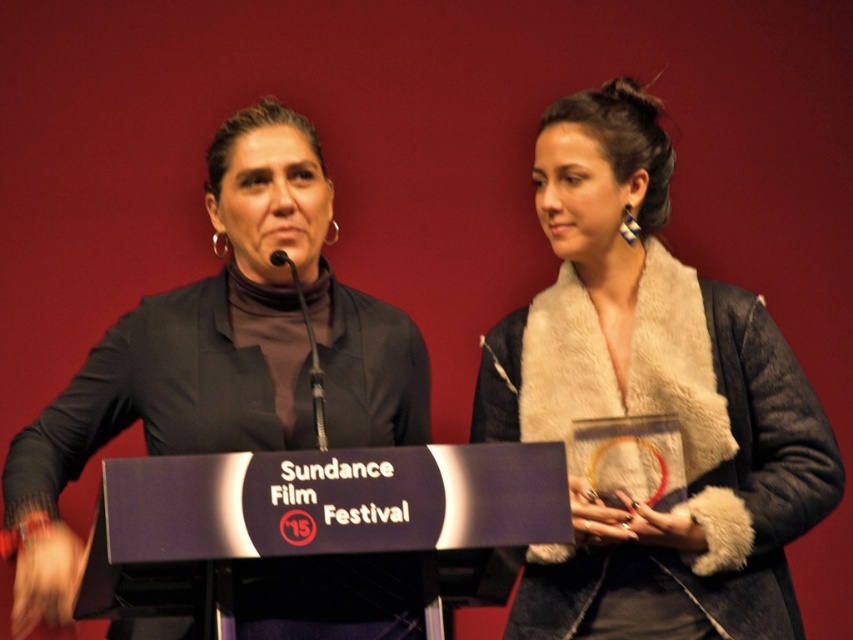
Question: Does fuzzy white scarf at center have a larger size compared to matte black jacket at center?

Choices:
 (A) no
 (B) yes

Answer: (A)

Question: From the image, what is the correct spatial relationship of fuzzy white scarf at center in relation to matte black jacket at center?

Choices:
 (A) right
 (B) left

Answer: (A)

Question: Can you confirm if fuzzy white scarf at center is wider than matte black jacket at center?

Choices:
 (A) no
 (B) yes

Answer: (A)

Question: Which point is farther to the camera?

Choices:
 (A) (795, 522)
 (B) (335, 388)

Answer: (B)